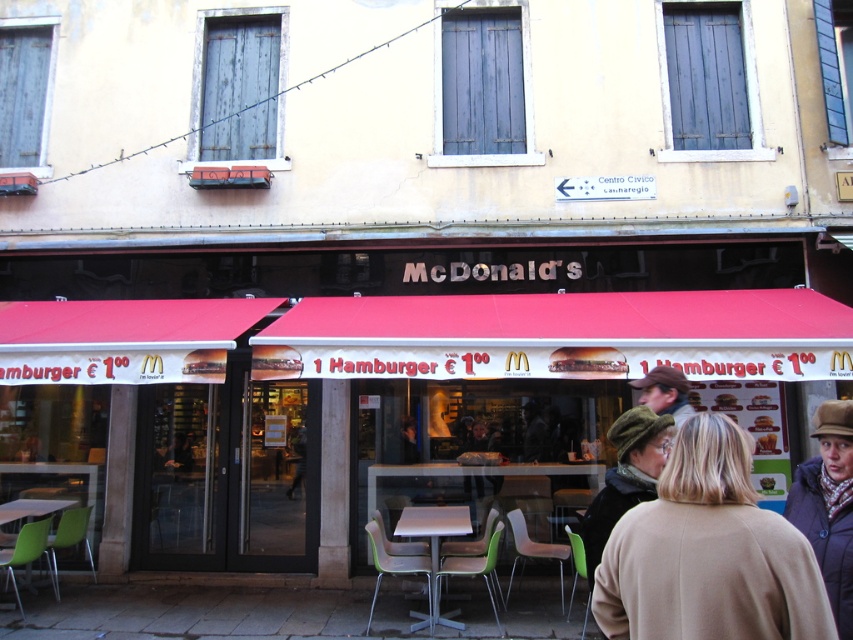
Does light brown woolen hat at center have a larger size compared to green felt hat at center?

No.

Is light brown woolen hat at center positioned before green felt hat at center?

Yes, it is.

Which is behind, point (730, 452) or point (659, 449)?

Point (659, 449)

Locate an element on the screen. light brown woolen hat at center is located at coordinates (708, 554).

Does matte red awning at center lie in front of brown woolen hat at upper right?

No.

Can you confirm if matte red awning at center is taller than brown woolen hat at upper right?

No.

The image size is (853, 640). I want to click on matte red awning at center, so click(x=566, y=323).

What do you see at coordinates (708, 554) in the screenshot? I see `light brown woolen hat at center` at bounding box center [708, 554].

Does light brown woolen hat at center have a lesser height compared to metallic gray table at center?

Yes, light brown woolen hat at center is shorter than metallic gray table at center.

The image size is (853, 640). What do you see at coordinates (708, 554) in the screenshot? I see `light brown woolen hat at center` at bounding box center [708, 554].

You are a GUI agent. You are given a task and a screenshot of the screen. Output one action in this format:
    pyautogui.click(x=<x>, y=<y>)
    Task: Click on the light brown woolen hat at center
    The width and height of the screenshot is (853, 640).
    Given the screenshot: What is the action you would take?
    pyautogui.click(x=708, y=554)